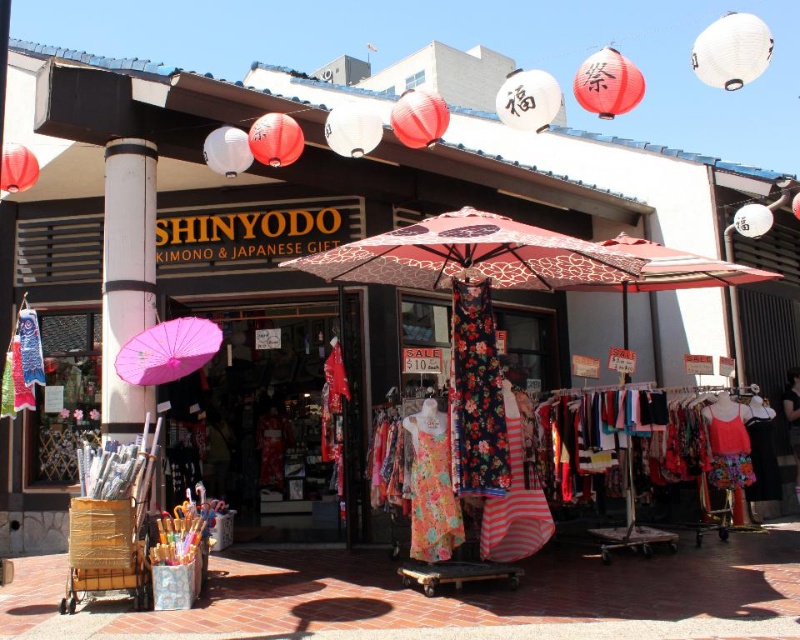
Who is more distant from viewer, (552, 257) or (197, 353)?

Positioned behind is point (552, 257).

Which is behind, point (428, 282) or point (178, 339)?

Positioned behind is point (428, 282).

Locate an element on the screen. This screenshot has height=640, width=800. floral-patterned fabric umbrella at center is located at coordinates (472, 257).

This screenshot has width=800, height=640. What do you see at coordinates (126, 276) in the screenshot?
I see `white matte pole at center` at bounding box center [126, 276].

Which is in front, point (130, 154) or point (725, 260)?

Point (130, 154)

Is point (110, 362) positioned before point (598, 285)?

Yes, point (110, 362) is closer to viewer.

At what (x,y) coordinates should I click in order to perform the action: click on white matte pole at center. Please return your answer as a coordinate pair (x, y). The width and height of the screenshot is (800, 640). Looking at the image, I should click on (126, 276).

Does point (642, 282) come closer to viewer compared to point (197, 362)?

No.

Who is lower down, red printed fabric umbrella at center or pink paper umbrella at left?

pink paper umbrella at left is below.

Who is more forward, (642,284) or (190,342)?

Point (190,342)

I want to click on red printed fabric umbrella at center, so [x=672, y=268].